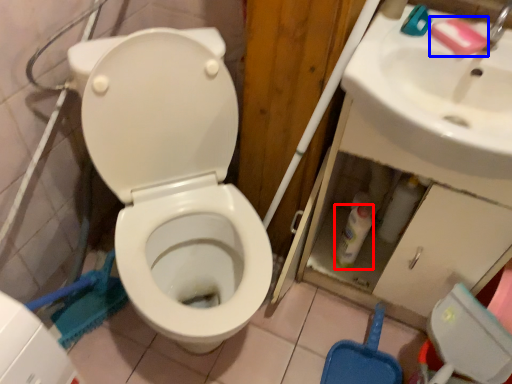
Question: Which object appears closest to the camera in this image, bottle (highlighted by a red box) or soap (highlighted by a blue box)?

Choices:
 (A) bottle
 (B) soap

Answer: (B)